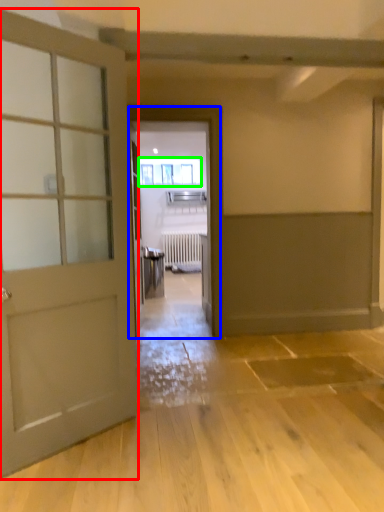
Question: Which object is the farthest from door (highlighted by a red box)? Choose among these: elevator (highlighted by a blue box) or window (highlighted by a green box).

Choices:
 (A) elevator
 (B) window

Answer: (B)